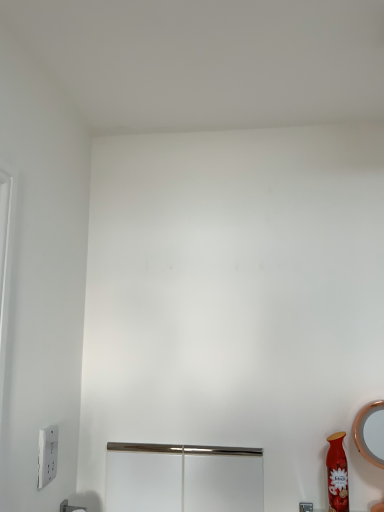
Question: Is matte red vase at lower right to the right of polished metal screen door at center from the viewer's perspective?

Choices:
 (A) no
 (B) yes

Answer: (B)

Question: Could you tell me if matte red vase at lower right is turned towards polished metal screen door at center?

Choices:
 (A) no
 (B) yes

Answer: (A)

Question: Would you consider matte red vase at lower right to be distant from polished metal screen door at center?

Choices:
 (A) yes
 (B) no

Answer: (B)

Question: Considering the relative sizes of matte red vase at lower right and polished metal screen door at center in the image provided, is matte red vase at lower right taller than polished metal screen door at center?

Choices:
 (A) yes
 (B) no

Answer: (A)

Question: Does matte red vase at lower right come behind polished metal screen door at center?

Choices:
 (A) yes
 (B) no

Answer: (B)

Question: From a real-world perspective, relative to matte red vase at lower right, is white plastic light switch at lower left vertically above or below?

Choices:
 (A) above
 (B) below

Answer: (A)

Question: Is white plastic light switch at lower left wider or thinner than matte red vase at lower right?

Choices:
 (A) wide
 (B) thin

Answer: (B)

Question: From the image's perspective, is white plastic light switch at lower left positioned above or below matte red vase at lower right?

Choices:
 (A) below
 (B) above

Answer: (B)

Question: Is white plastic light switch at lower left bigger or smaller than matte red vase at lower right?

Choices:
 (A) big
 (B) small

Answer: (B)

Question: Based on their sizes in the image, would you say polished metal screen door at center is bigger or smaller than matte red vase at lower right?

Choices:
 (A) big
 (B) small

Answer: (A)

Question: Looking at their shapes, would you say polished metal screen door at center is wider or thinner than matte red vase at lower right?

Choices:
 (A) wide
 (B) thin

Answer: (B)

Question: From the image's perspective, is polished metal screen door at center positioned above or below matte red vase at lower right?

Choices:
 (A) below
 (B) above

Answer: (A)

Question: Choose the correct answer: Is polished metal screen door at center inside matte red vase at lower right or outside it?

Choices:
 (A) inside
 (B) outside

Answer: (B)

Question: In terms of size, does matte red vase at lower right appear bigger or smaller than white plastic light switch at lower left?

Choices:
 (A) big
 (B) small

Answer: (A)

Question: Is matte red vase at lower right wider or thinner than white plastic light switch at lower left?

Choices:
 (A) thin
 (B) wide

Answer: (B)